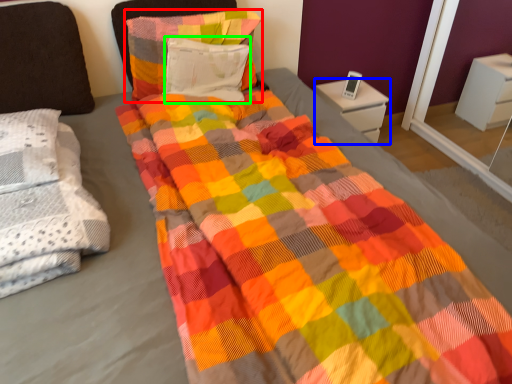
Question: Which is nearer to the pillow (highlighted by a red box)? nightstand (highlighted by a blue box) or pillow (highlighted by a green box).

Choices:
 (A) nightstand
 (B) pillow

Answer: (B)